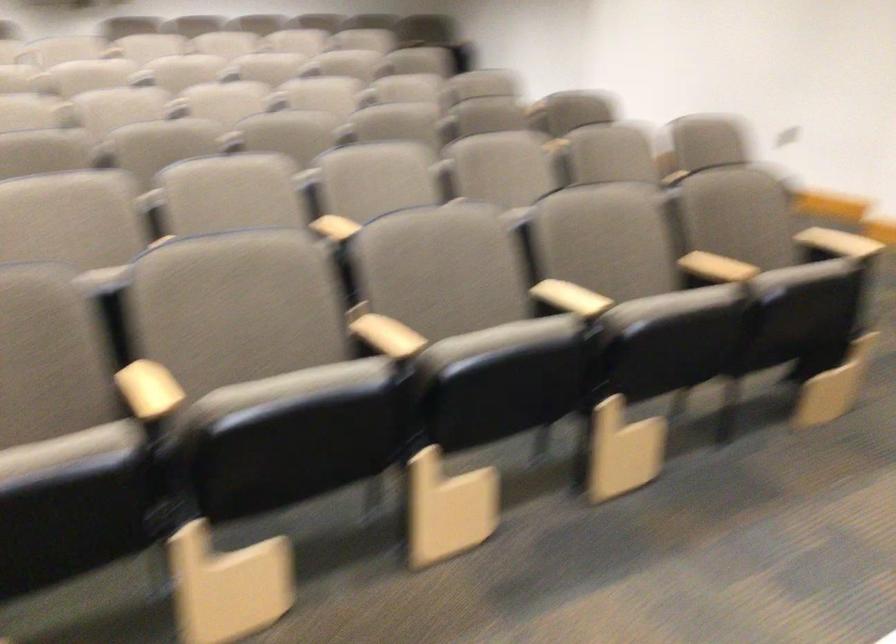
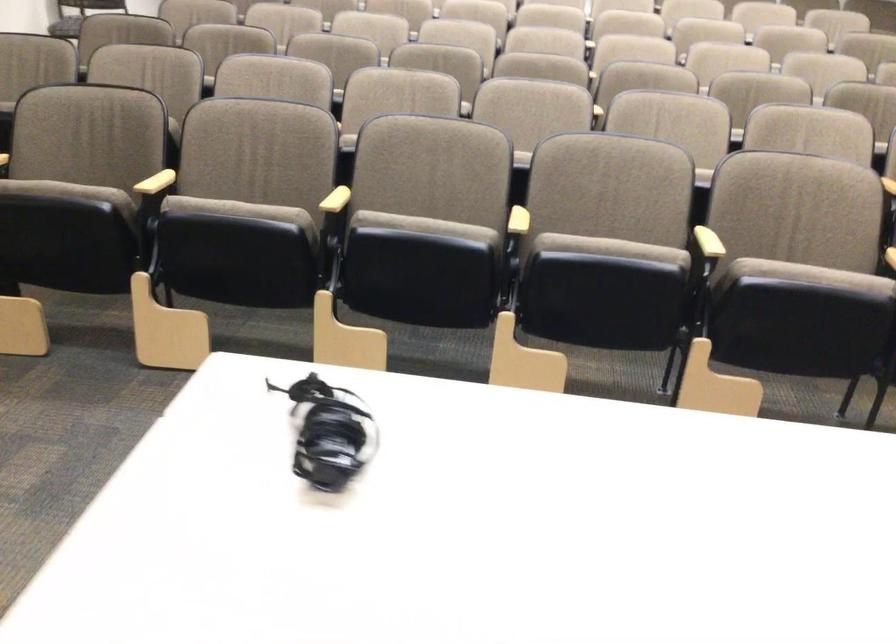
Locate, in the second image, the point that corresponds to point 160,404 in the first image.

(336, 200)